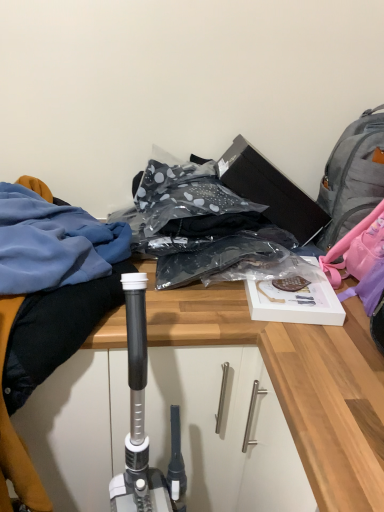
Question: Could you tell me if blue fabric at left is facing gray fabric backpack at upper right?

Choices:
 (A) no
 (B) yes

Answer: (A)

Question: Is blue fabric at left to the left of gray fabric backpack at upper right from the viewer's perspective?

Choices:
 (A) no
 (B) yes

Answer: (B)

Question: Is the position of blue fabric at left less distant than that of gray fabric backpack at upper right?

Choices:
 (A) yes
 (B) no

Answer: (A)

Question: Is blue fabric at left bigger than gray fabric backpack at upper right?

Choices:
 (A) no
 (B) yes

Answer: (B)

Question: Does blue fabric at left have a lesser width compared to gray fabric backpack at upper right?

Choices:
 (A) no
 (B) yes

Answer: (A)

Question: From a real-world perspective, is blue fabric at left physically below gray fabric backpack at upper right?

Choices:
 (A) no
 (B) yes

Answer: (B)

Question: Does wooden desk at center have a lesser height compared to blue fabric at left?

Choices:
 (A) no
 (B) yes

Answer: (A)

Question: Is wooden desk at center not close to blue fabric at left?

Choices:
 (A) no
 (B) yes

Answer: (A)

Question: Does wooden desk at center have a larger size compared to blue fabric at left?

Choices:
 (A) no
 (B) yes

Answer: (A)

Question: Can you see wooden desk at center touching blue fabric at left?

Choices:
 (A) no
 (B) yes

Answer: (A)

Question: Does wooden desk at center come in front of blue fabric at left?

Choices:
 (A) no
 (B) yes

Answer: (B)

Question: Does wooden desk at center have a smaller size compared to blue fabric at left?

Choices:
 (A) no
 (B) yes

Answer: (B)

Question: Are gray fabric backpack at upper right and wooden desk at center far apart?

Choices:
 (A) yes
 (B) no

Answer: (B)